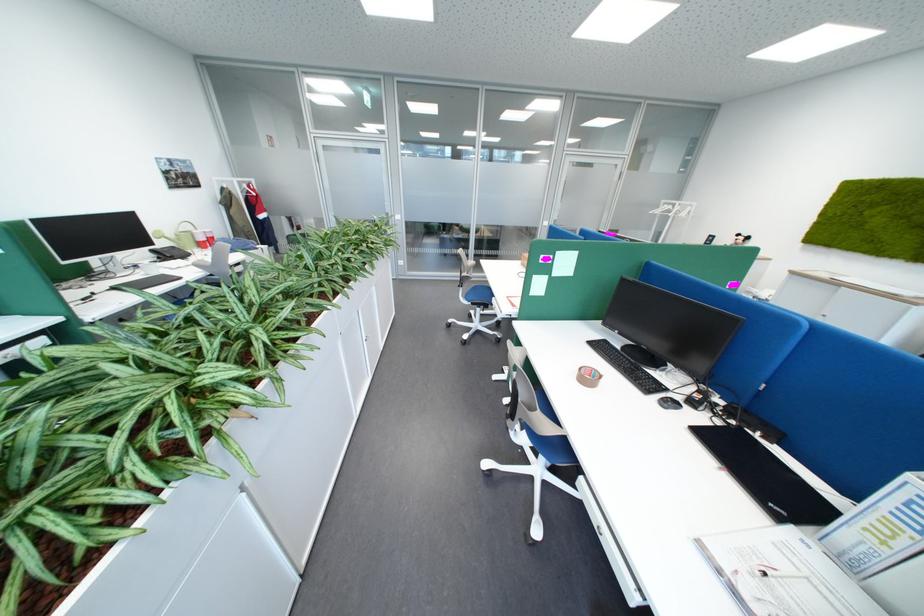
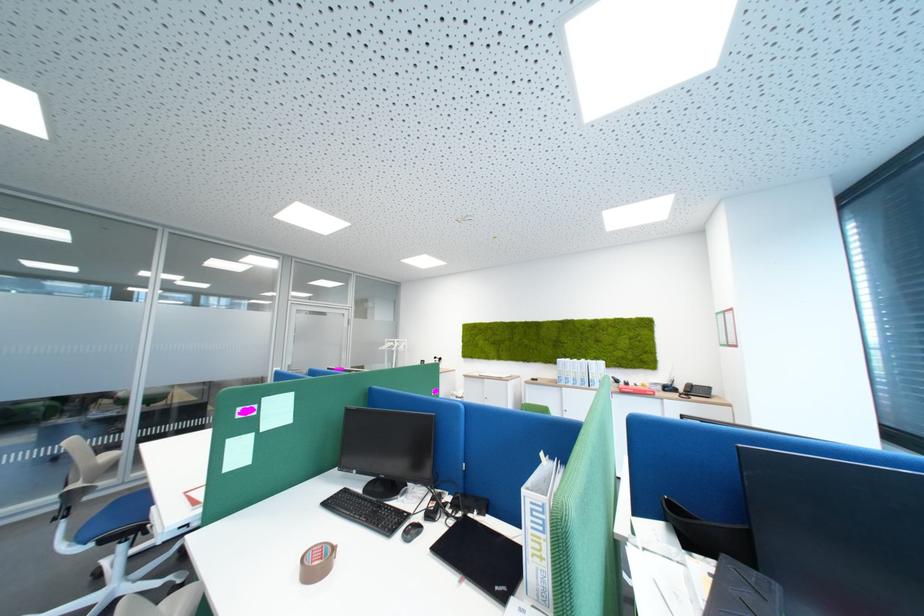
Locate, in the second image, the point that corresponds to point 489,328 in the first image.

(124, 594)